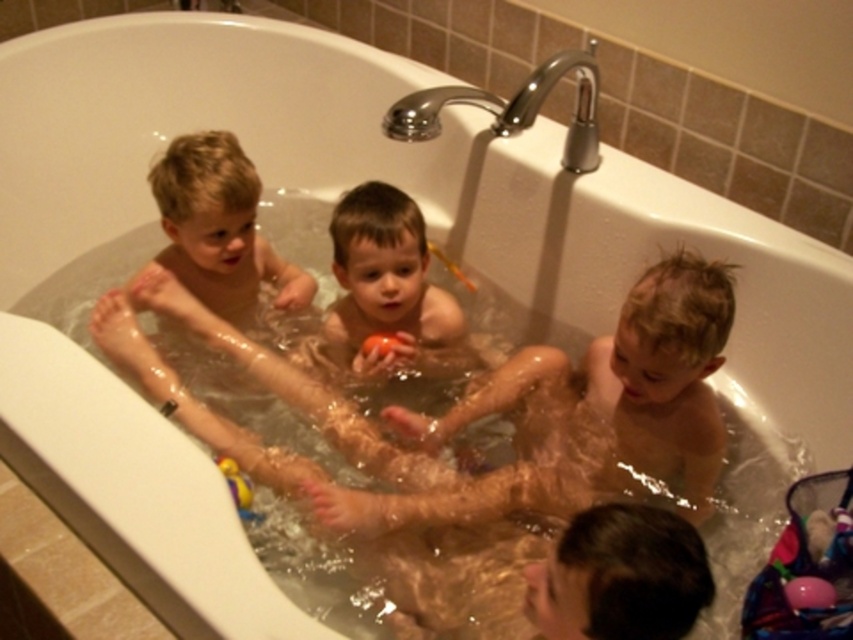
Question: Is smooth skin child at center closer to the viewer compared to yellow rubber duck at lower left?

Choices:
 (A) no
 (B) yes

Answer: (A)

Question: Considering the real-world distances, which object is closest to the smooth skin child at center?

Choices:
 (A) yellow rubber duck at lower left
 (B) rubber matte ball at center

Answer: (B)

Question: From the image, what is the correct spatial relationship of smooth skin child at center in relation to yellow rubber duck at lower left?

Choices:
 (A) above
 (B) below

Answer: (A)

Question: Which object appears closest to the camera in this image?

Choices:
 (A) rubber matte ball at center
 (B) smooth skin child at center

Answer: (B)

Question: Among these objects, which one is farthest from the camera?

Choices:
 (A) yellow rubber duck at lower left
 (B) rubber matte ball at center
 (C) smooth skin child at center

Answer: (B)

Question: Can you confirm if smooth skin child at center is positioned above yellow rubber duck at lower left?

Choices:
 (A) yes
 (B) no

Answer: (A)